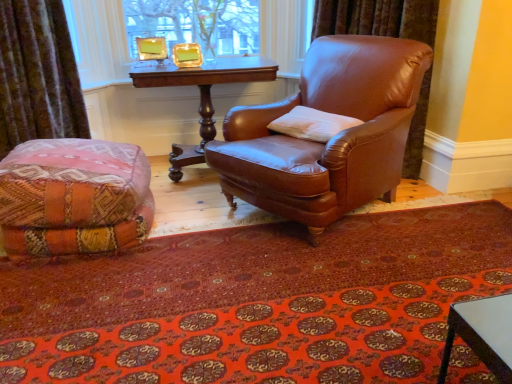
Question: In terms of height, does velvet brown curtain at lower left look taller or shorter compared to gold-framed picture at upper center?

Choices:
 (A) short
 (B) tall

Answer: (B)

Question: From a real-world perspective, is velvet brown curtain at lower left above or below gold-framed picture at upper center?

Choices:
 (A) above
 (B) below

Answer: (B)

Question: Based on their relative distances, which object is farther from the multicolored woven ottoman at lower left?

Choices:
 (A) velvet brown curtain at lower left
 (B) mahogany wood table at center
 (C) gold-framed picture at upper center
 (D) white soft pillow at center
 (E) carpeted mat at lower center

Answer: (C)

Question: Which of these objects is positioned closest to the velvet brown curtain at lower left?

Choices:
 (A) brown leather chair at center
 (B) gold-framed picture at upper center
 (C) multicolored woven ottoman at lower left
 (D) carpeted mat at lower center
 (E) mahogany wood table at center

Answer: (C)